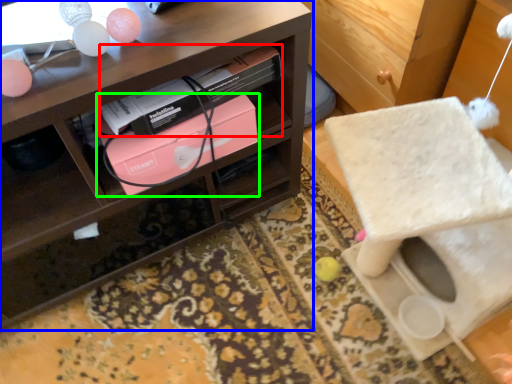
Question: Considering the real-world distances, which object is farthest from book (highlighted by a red box)? shelf (highlighted by a blue box) or box (highlighted by a green box)?

Choices:
 (A) shelf
 (B) box

Answer: (A)